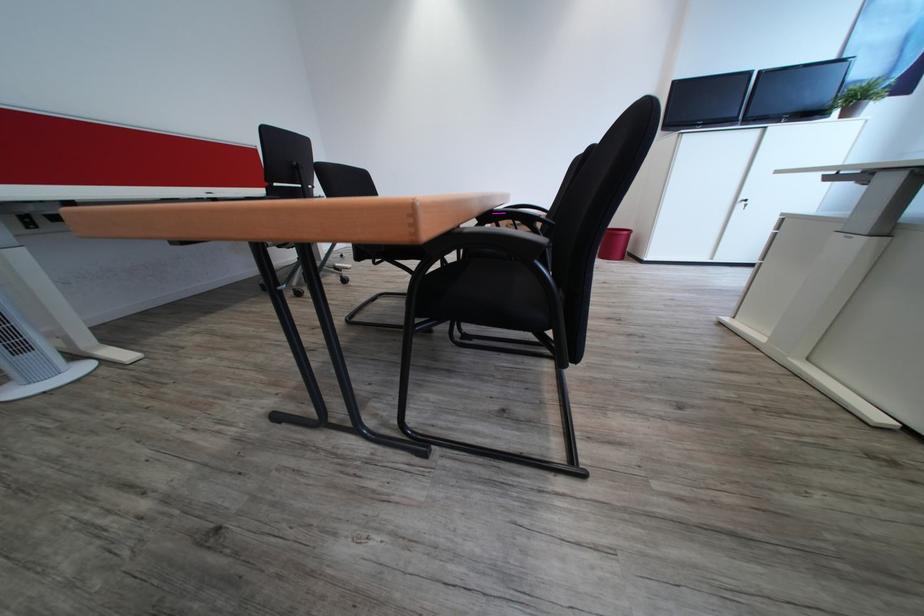
Where is `black chair armrest`? The image size is (924, 616). black chair armrest is located at coordinates (515, 217).